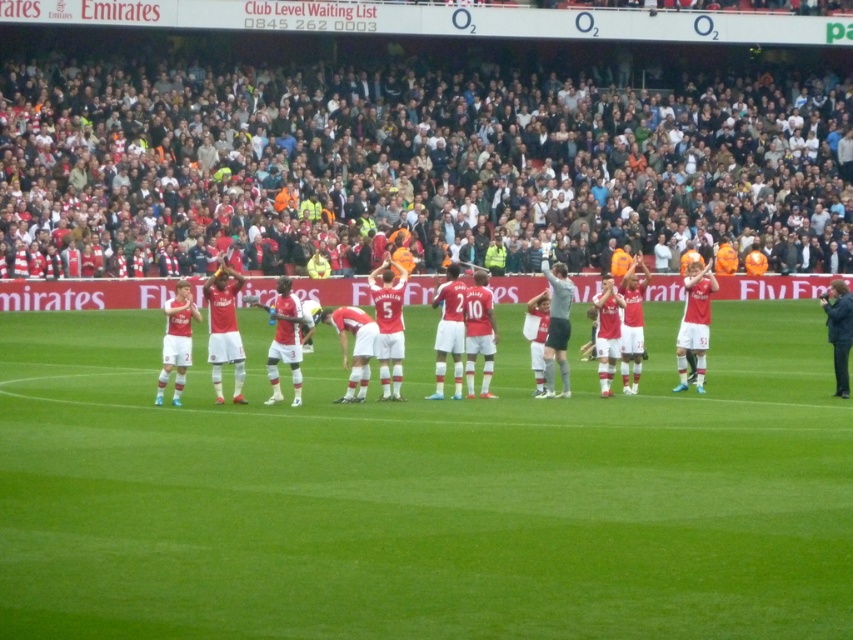
Question: Can you confirm if green grass football field at center is thinner than matte red jersey at center?

Choices:
 (A) yes
 (B) no

Answer: (A)

Question: Estimate the real-world distances between objects in this image. Which object is farther from the green grass football field at center?

Choices:
 (A) matte red jersey at center
 (B) dark gray crowd at upper center

Answer: (B)

Question: Is green grass football field at center bigger than matte red jersey at center?

Choices:
 (A) yes
 (B) no

Answer: (B)

Question: Considering the real-world distances, which object is farthest from the green grass football field at center?

Choices:
 (A) dark gray crowd at upper center
 (B) matte red jersey at center

Answer: (A)

Question: Which object appears closest to the camera in this image?

Choices:
 (A) dark gray crowd at upper center
 (B) green grass football field at center

Answer: (B)

Question: Observing the image, what is the correct spatial positioning of green grass football field at center in reference to matte red jersey at center?

Choices:
 (A) above
 (B) below

Answer: (B)